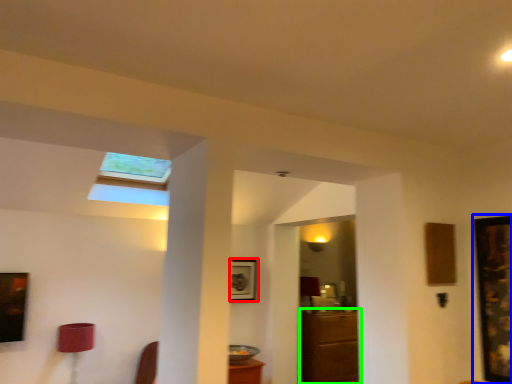
Question: Which is farther away from picture frame (highlighted by a red box)? picture frame (highlighted by a blue box) or furniture (highlighted by a green box)?

Choices:
 (A) picture frame
 (B) furniture

Answer: (A)